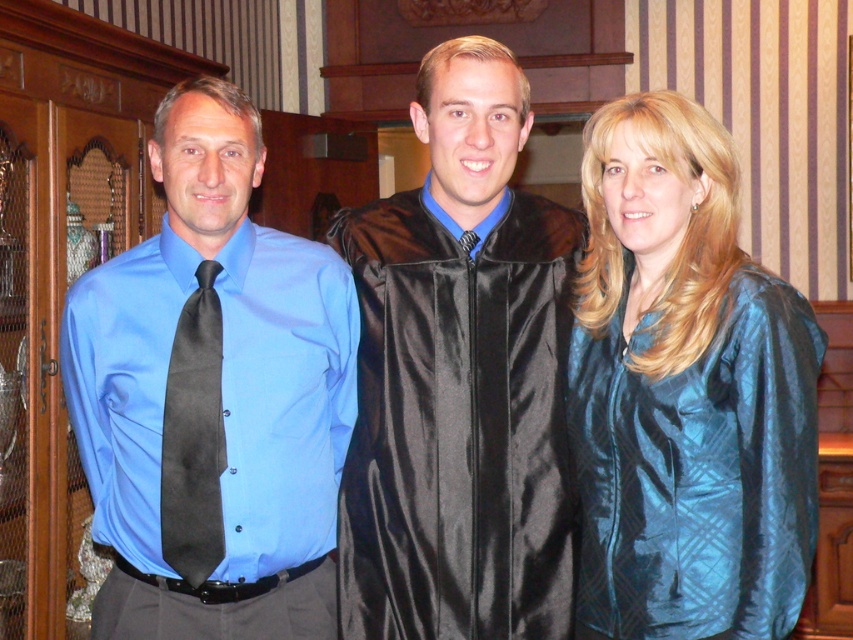
Is satin black gown at center wider than black satin tie at left?

Correct, the width of satin black gown at center exceeds that of black satin tie at left.

Which is more to the right, satin black gown at center or black satin tie at left?

satin black gown at center

This screenshot has width=853, height=640. Describe the element at coordinates (460, 378) in the screenshot. I see `satin black gown at center` at that location.

You are a GUI agent. You are given a task and a screenshot of the screen. Output one action in this format:
    pyautogui.click(x=<x>, y=<y>)
    Task: Click on the satin black gown at center
    Image resolution: width=853 pixels, height=640 pixels.
    Given the screenshot: What is the action you would take?
    pyautogui.click(x=460, y=378)

Is point (793, 424) positioned in front of point (190, 369)?

Yes, it is in front of point (190, 369).

Is teal silk blouse at center closer to the viewer compared to black satin tie at left?

Yes, teal silk blouse at center is closer to the viewer.

What do you see at coordinates (685, 392) in the screenshot? I see `teal silk blouse at center` at bounding box center [685, 392].

Locate an element on the screen. This screenshot has height=640, width=853. teal silk blouse at center is located at coordinates (685, 392).

Measure the distance between point [161,396] and camera.

The distance of point [161,396] from camera is 2.02 meters.

In the scene shown: Can you confirm if matte blue shirt at left is taller than black satin tie at left?

Yes.

Which is in front, point (273, 445) or point (173, 388)?

Point (173, 388) is in front.

I want to click on matte blue shirt at left, so click(212, 397).